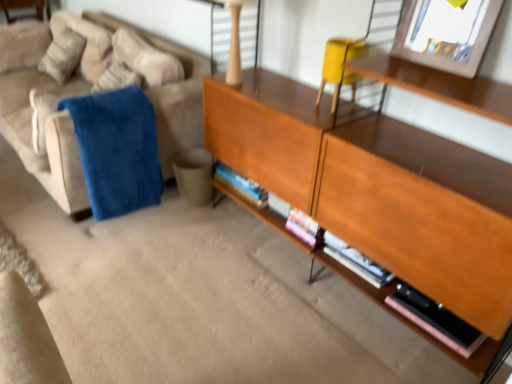
Question: Relative to matte yellow swivel chair at upper right, is suede couch at left in front or behind?

Choices:
 (A) behind
 (B) front

Answer: (A)

Question: From a real-world perspective, is suede couch at left physically located above or below matte yellow swivel chair at upper right?

Choices:
 (A) above
 (B) below

Answer: (B)

Question: Which object is the farthest from the matte beige table lamp at upper center?

Choices:
 (A) wooden cabinet at center
 (B) pink matte book at lower right
 (C) matte yellow swivel chair at upper right
 (D) suede couch at left
 (E) blue plush blanket at left

Answer: (B)

Question: Which object is the closest to the wooden cabinet at center?

Choices:
 (A) matte beige table lamp at upper center
 (B) wooden picture frame at upper right
 (C) blue plush blanket at left
 (D) matte yellow swivel chair at upper right
 (E) pink matte book at lower right

Answer: (D)